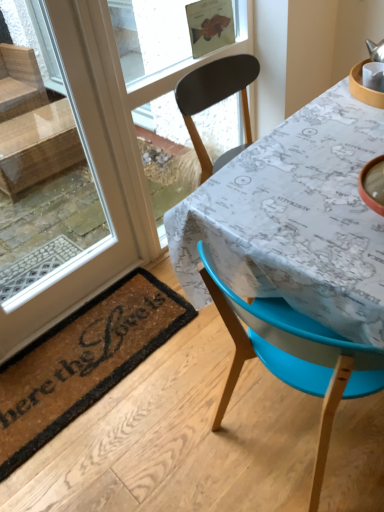
Question: Would you say blue plastic chair at lower right is inside or outside map-patterned fabric at center?

Choices:
 (A) outside
 (B) inside

Answer: (B)

Question: From the image's perspective, is blue plastic chair at lower right located above or below map-patterned fabric at center?

Choices:
 (A) below
 (B) above

Answer: (A)

Question: Estimate the real-world distances between objects in this image. Which object is farther from the transparent glass window at upper left?

Choices:
 (A) transparent glass window screen at upper center
 (B) brown coir mat at lower left
 (C) map-patterned fabric at center
 (D) blue plastic chair at lower right

Answer: (D)

Question: Which object is positioned farthest from the blue plastic chair at lower right?

Choices:
 (A) map-patterned fabric at center
 (B) transparent glass window screen at upper center
 (C) brown coir mat at lower left
 (D) transparent glass window at upper left

Answer: (B)